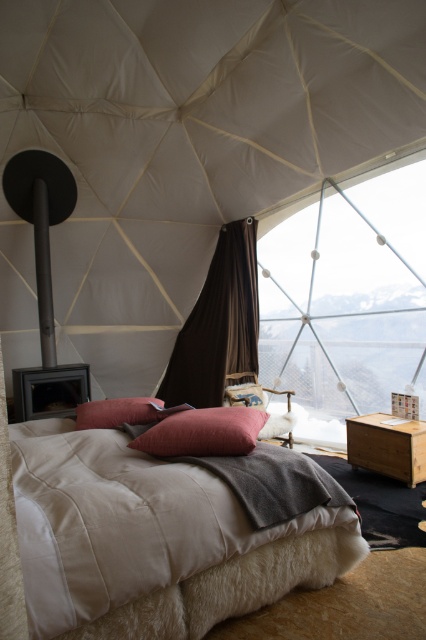
In the scene shown: Is transparent glass window at upper center above brown wooden dresser at right?

Correct, transparent glass window at upper center is located above brown wooden dresser at right.

Between transparent glass window at upper center and brown wooden dresser at right, which one has more height?

With more height is transparent glass window at upper center.

Is point (307, 244) closer to viewer compared to point (423, 433)?

No.

The image size is (426, 640). In order to click on transparent glass window at upper center in this screenshot , I will do `click(345, 298)`.

The height and width of the screenshot is (640, 426). Describe the element at coordinates (345, 298) in the screenshot. I see `transparent glass window at upper center` at that location.

Image resolution: width=426 pixels, height=640 pixels. What do you see at coordinates (345, 298) in the screenshot?
I see `transparent glass window at upper center` at bounding box center [345, 298].

In order to click on transparent glass window at upper center in this screenshot , I will do `click(345, 298)`.

Is point (291, 342) farther from viewer compared to point (213, 422)?

Yes.

Does transparent glass window at upper center appear over matte pink pillow at center?

Correct, transparent glass window at upper center is located above matte pink pillow at center.

Between point (417, 310) and point (181, 444), which one is positioned in front?

Point (181, 444) is more forward.

You are a GUI agent. You are given a task and a screenshot of the screen. Output one action in this format:
    pyautogui.click(x=<x>, y=<y>)
    Task: Click on the transparent glass window at upper center
    
    Given the screenshot: What is the action you would take?
    pyautogui.click(x=345, y=298)